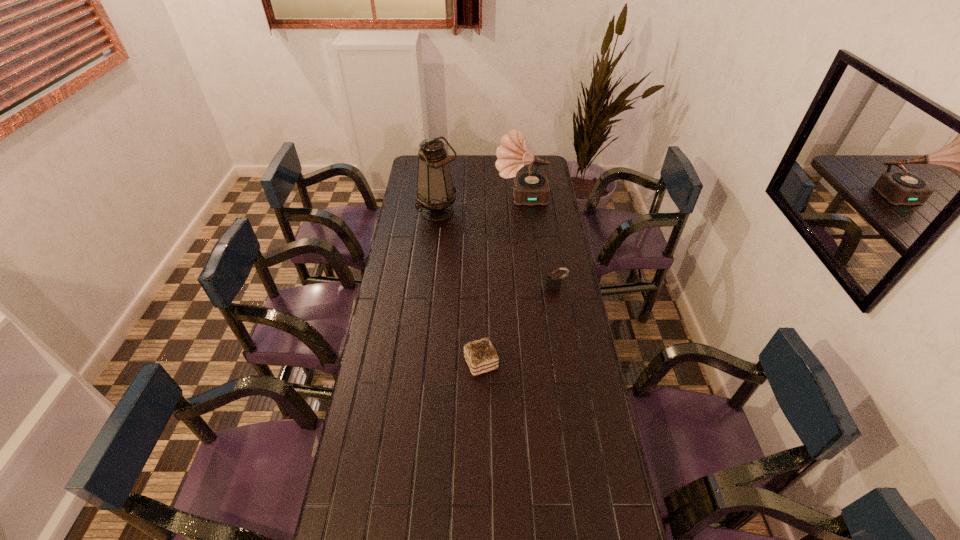
Find the location of a particular element. free space located 0.070m with the keyhole on the front of the third tallest object is located at coordinates (559, 302).

This screenshot has height=540, width=960. What are the coordinates of `vacant space positioned on the right of the chocolate cake` in the screenshot? It's located at (571, 363).

In order to click on object positioned at the left edge in this screenshot , I will do `click(435, 195)`.

The width and height of the screenshot is (960, 540). Find the location of `record player that is positioned at the right edge`. record player that is positioned at the right edge is located at coordinates (530, 188).

The height and width of the screenshot is (540, 960). I want to click on padlock that is at the right edge, so click(x=553, y=282).

Locate an element on the screen. The image size is (960, 540). vacant space at the far edge of the desktop is located at coordinates (457, 174).

Identify the location of blank area at the left edge. (413, 240).

What are the coordinates of `blank space at the right edge of the desktop` in the screenshot? It's located at (569, 334).

Where is `empty space that is in between the padlock and the third object from right to left`? The height and width of the screenshot is (540, 960). empty space that is in between the padlock and the third object from right to left is located at coordinates (518, 325).

Locate an element on the screen. vacant area that lies between the chocolate cake and the leftmost object is located at coordinates (460, 287).